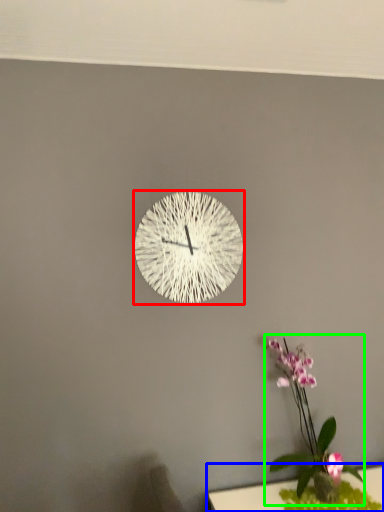
Question: Estimate the real-world distances between objects in this image. Which object is closer to wall clock (highlighted by a red box), table (highlighted by a blue box) or floral arrangement (highlighted by a green box)?

Choices:
 (A) table
 (B) floral arrangement

Answer: (B)